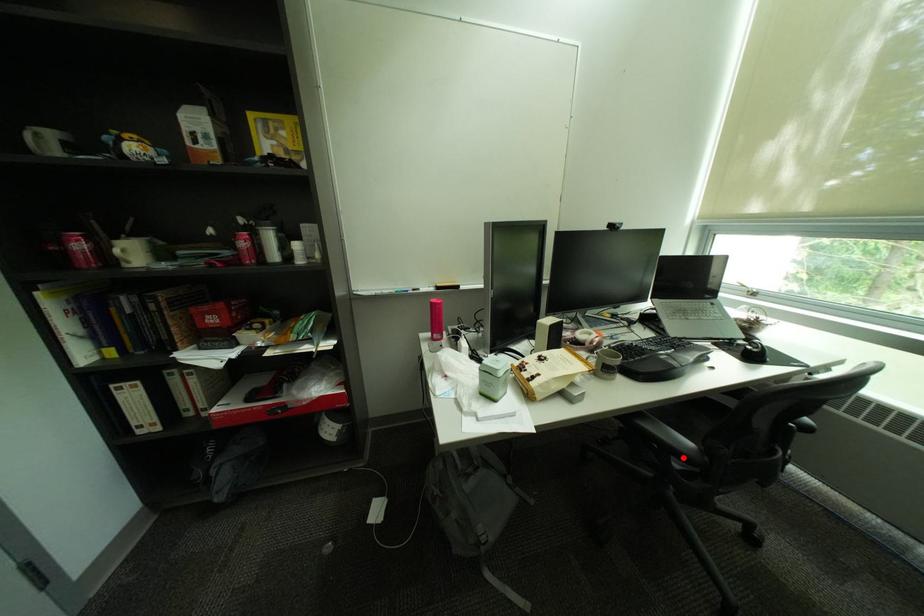
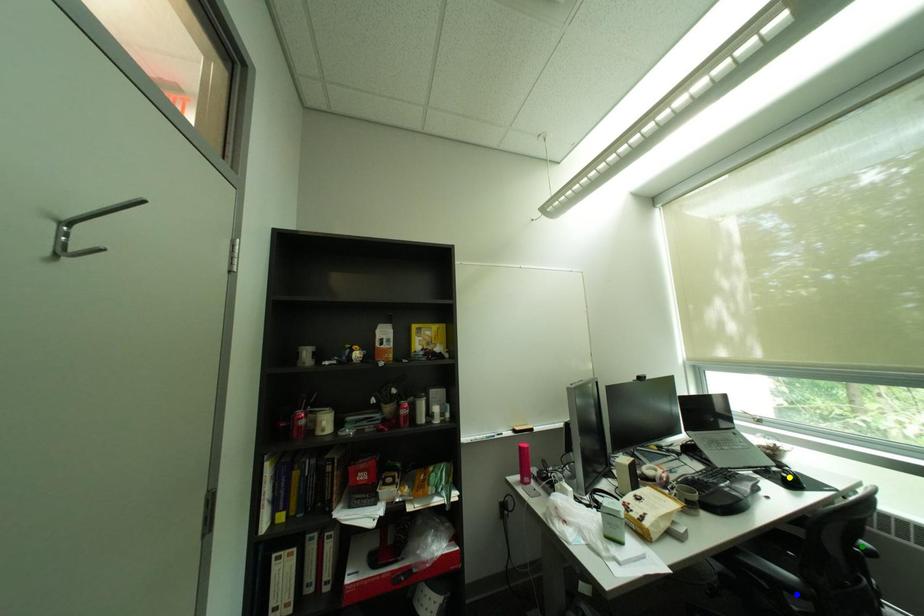
Question: I am providing you with two images of the same scene from different viewpoints. A red point is marked on the first image. You are given multiple points on the second image. Can you choose the point in image 2 that corresponds to the point in image 1?

Choices:
 (A) yellow point
 (B) green point
 (C) blue point

Answer: (C)